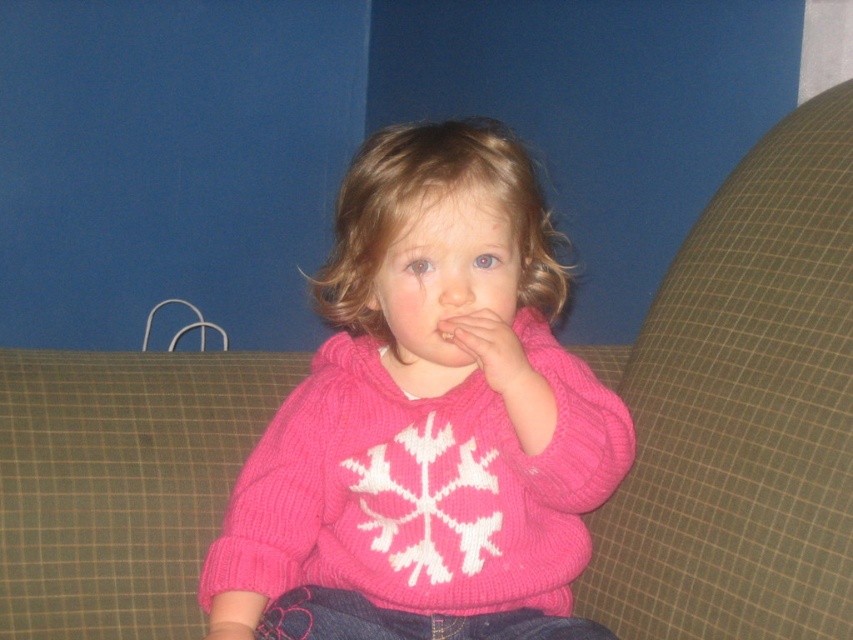
Can you confirm if pink knitted sweater at center is wider than pink knitted mouth at center?

Yes.

Is pink knitted sweater at center taller than pink knitted mouth at center?

Yes.

Is point (457, 492) positioned behind point (456, 337)?

That is True.

The height and width of the screenshot is (640, 853). I want to click on pink knitted sweater at center, so click(424, 422).

Who is higher up, pink knitted sweater at center or matte pink sweater at center?

matte pink sweater at center is higher up.

Does pink knitted sweater at center have a smaller size compared to matte pink sweater at center?

No.

Does point (352, 420) come farther from viewer compared to point (497, 371)?

Yes, it is.

The height and width of the screenshot is (640, 853). In order to click on pink knitted sweater at center in this screenshot , I will do pyautogui.click(x=424, y=422).

Who is lower down, matte pink sweater at center or pink knitted mouth at center?

matte pink sweater at center

Image resolution: width=853 pixels, height=640 pixels. Describe the element at coordinates (492, 353) in the screenshot. I see `matte pink sweater at center` at that location.

The width and height of the screenshot is (853, 640). Find the location of `matte pink sweater at center`. matte pink sweater at center is located at coordinates (492, 353).